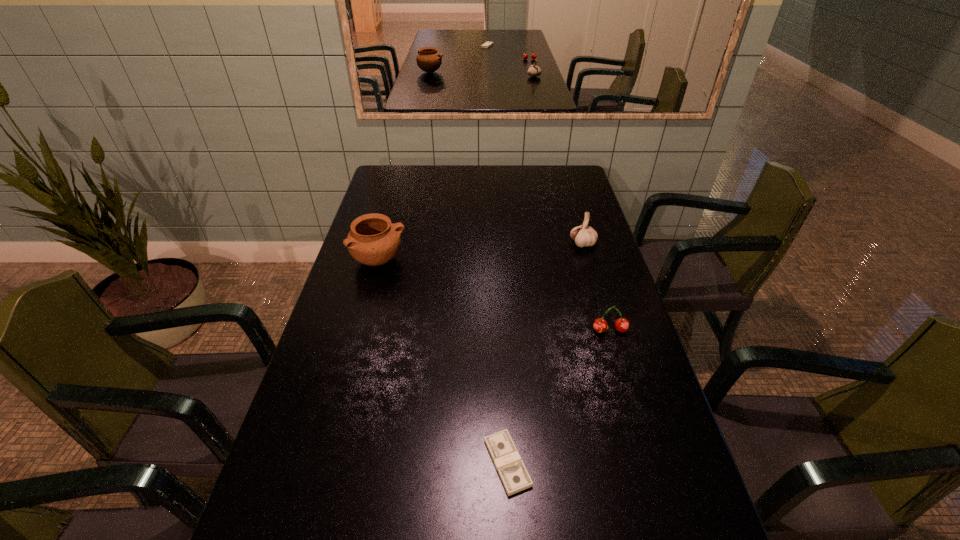
Where is `vacant space that satisfies the following two spatial constraints: 1. on the front side of the leftmost object; 2. on the right side of the dollar`? The width and height of the screenshot is (960, 540). vacant space that satisfies the following two spatial constraints: 1. on the front side of the leftmost object; 2. on the right side of the dollar is located at coordinates (324, 463).

Where is `blank space that satisfies the following two spatial constraints: 1. on the front side of the pottery; 2. on the right side of the shortest object`? The image size is (960, 540). blank space that satisfies the following two spatial constraints: 1. on the front side of the pottery; 2. on the right side of the shortest object is located at coordinates (324, 463).